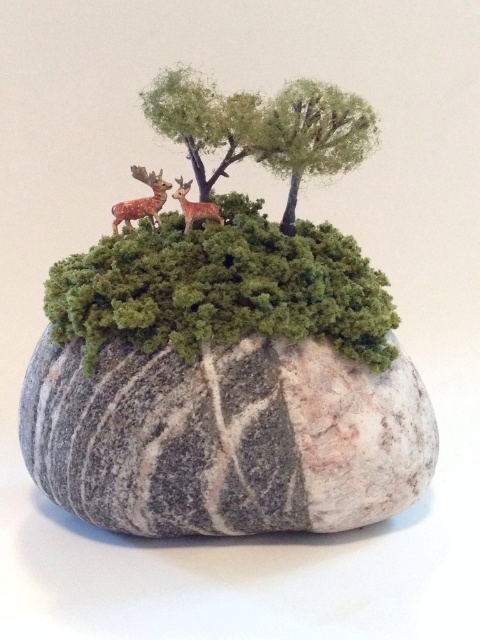
Between point (301, 168) and point (190, 202), which one is positioned in front?

Point (301, 168) is more forward.

Is point (268, 134) more distant than point (220, 224)?

No, (268, 134) is in front of (220, 224).

Find the location of a particular element. Image resolution: width=480 pixels, height=640 pixels. green textured tree at upper center is located at coordinates (312, 134).

Identify the location of green textured tree at upper center. (312, 134).

Does green matte trees at upper center appear over shiny brown deer at center?

Indeed, green matte trees at upper center is positioned over shiny brown deer at center.

Can you confirm if green matte trees at upper center is shorter than shiny brown deer at center?

In fact, green matte trees at upper center may be taller than shiny brown deer at center.

This screenshot has width=480, height=640. Find the location of `green matte trees at upper center`. green matte trees at upper center is located at coordinates (203, 120).

Who is more distant from viewer, [320,88] or [156,109]?

The point [156,109] is more distant.

Is green textured tree at upper center to the right of green matte trees at upper center from the viewer's perspective?

Yes, green textured tree at upper center is to the right of green matte trees at upper center.

Describe the element at coordinates (312, 134) in the screenshot. I see `green textured tree at upper center` at that location.

In order to click on green textured tree at upper center in this screenshot , I will do coord(312,134).